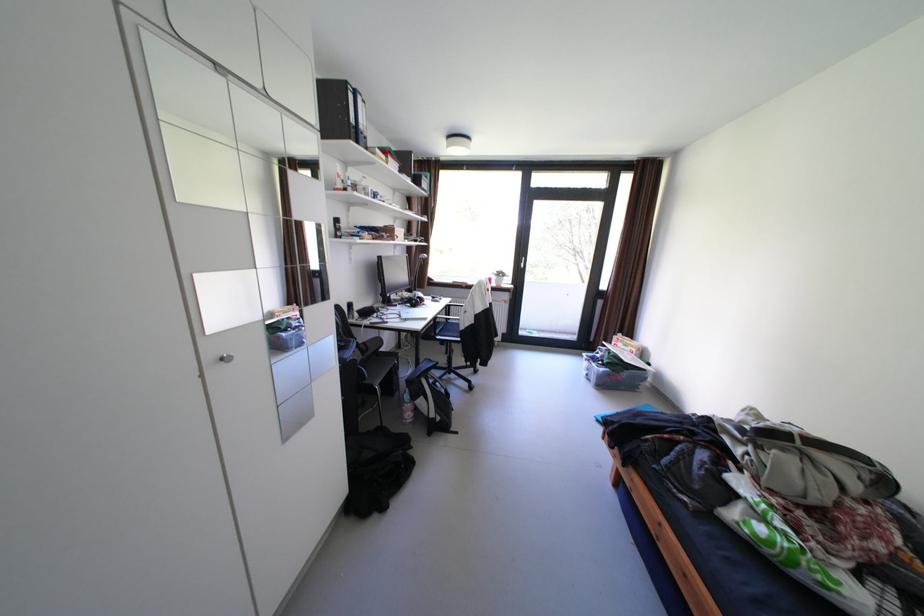
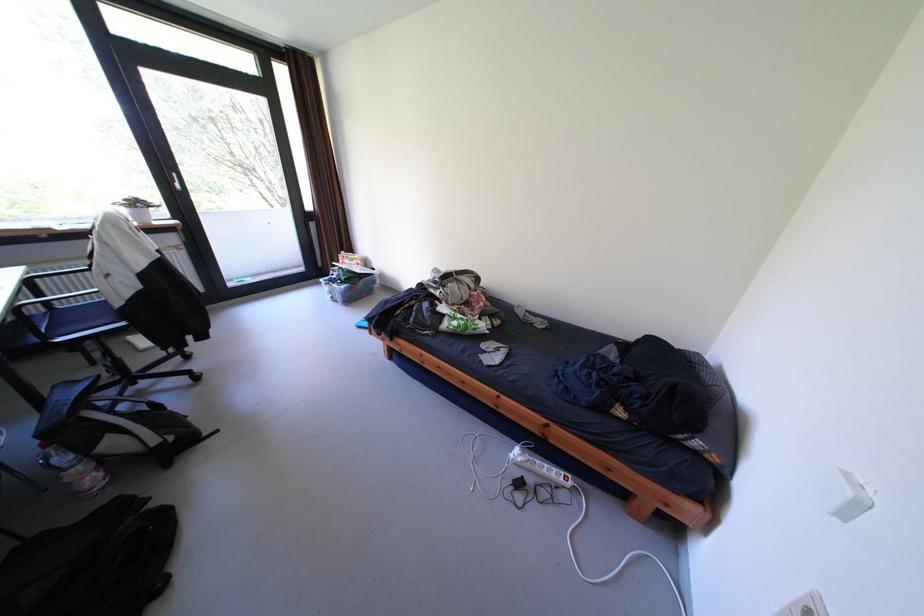
Locate, in the second image, the point that corresponds to point 512,275 in the first image.

(149, 205)